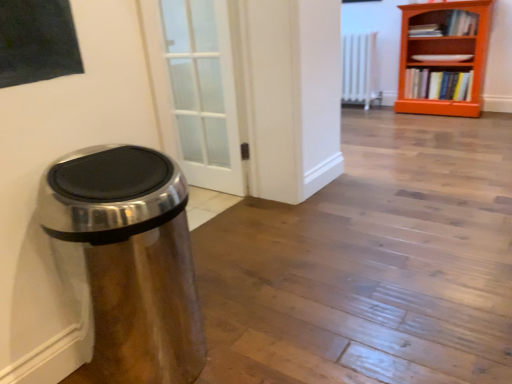
Question: Could orange wooden bookcase at upper right be considered to be inside hardcover book at right, which is the 2th book from top to bottom?

Choices:
 (A) no
 (B) yes

Answer: (A)

Question: Can you confirm if hardcover book at right, which is the 2th book from top to bottom, is thinner than orange wooden bookcase at upper right?

Choices:
 (A) no
 (B) yes

Answer: (B)

Question: Is hardcover book at right, which appears as the 1th book when ordered from the bottom, further to the viewer compared to orange wooden bookcase at upper right?

Choices:
 (A) yes
 (B) no

Answer: (A)

Question: Are hardcover book at right, which is the 2th book from top to bottom, and orange wooden bookcase at upper right beside each other?

Choices:
 (A) no
 (B) yes

Answer: (A)

Question: Is hardcover book at right, which appears as the 1th book when ordered from the bottom, looking in the opposite direction of orange wooden bookcase at upper right?

Choices:
 (A) no
 (B) yes

Answer: (B)

Question: Looking at their shapes, would you say white metallic radiator at center is wider or thinner than hardcover book at upper right, which is counted as the first book, starting from the top?

Choices:
 (A) wide
 (B) thin

Answer: (A)

Question: Would you say white metallic radiator at center is to the left or to the right of hardcover book at upper right, which is counted as the first book, starting from the top, in the picture?

Choices:
 (A) right
 (B) left

Answer: (B)

Question: From their relative heights in the image, would you say white metallic radiator at center is taller or shorter than hardcover book at upper right, the 2th book ordered from the bottom?

Choices:
 (A) short
 (B) tall

Answer: (B)

Question: Is white metallic radiator at center bigger or smaller than hardcover book at upper right, the 2th book ordered from the bottom?

Choices:
 (A) small
 (B) big

Answer: (B)

Question: From the image's perspective, is orange wooden bookcase at upper right positioned above or below hardcover book at upper right, the 2th book ordered from the bottom?

Choices:
 (A) below
 (B) above

Answer: (A)

Question: Is point tap(407, 56) positioned closer to the camera than point tap(463, 14)?

Choices:
 (A) closer
 (B) farther

Answer: (B)

Question: From a real-world perspective, is orange wooden bookcase at upper right above or below hardcover book at upper right, the 2th book ordered from the bottom?

Choices:
 (A) below
 (B) above

Answer: (A)

Question: In terms of height, does orange wooden bookcase at upper right look taller or shorter compared to hardcover book at upper right, the 2th book ordered from the bottom?

Choices:
 (A) short
 (B) tall

Answer: (B)

Question: Considering the positions of satin metallic trash can at left and hardcover book at upper right, which is counted as the first book, starting from the top, in the image, is satin metallic trash can at left bigger or smaller than hardcover book at upper right, which is counted as the first book, starting from the top,?

Choices:
 (A) small
 (B) big

Answer: (B)

Question: From the image's perspective, relative to hardcover book at upper right, which is counted as the first book, starting from the top, is satin metallic trash can at left above or below?

Choices:
 (A) above
 (B) below

Answer: (B)